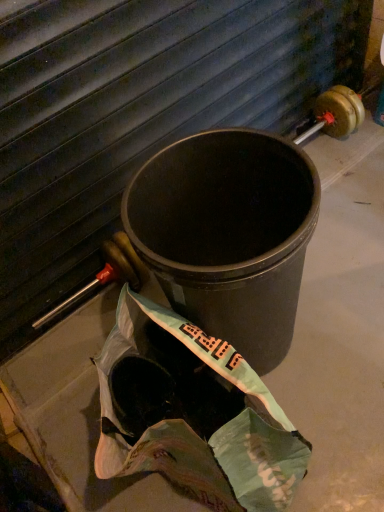
Describe the element at coordinates (228, 234) in the screenshot. I see `black matte trash can at center` at that location.

The height and width of the screenshot is (512, 384). I want to click on black matte trash can at center, so click(228, 234).

Identify the location of black matte trash can at center. The height and width of the screenshot is (512, 384). (228, 234).